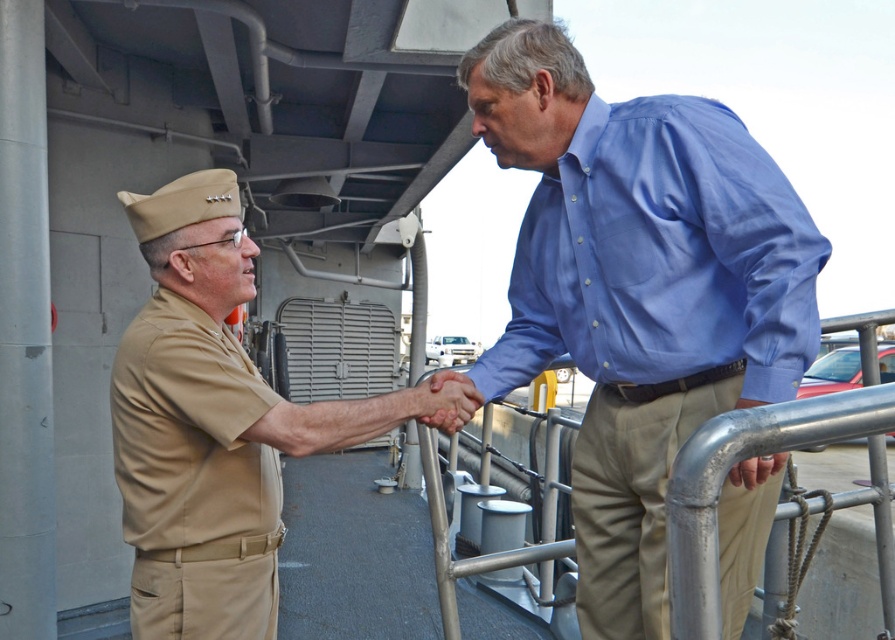
Measure the distance between point (x=274, y=636) and camera.

A distance of 2.18 meters exists between point (x=274, y=636) and camera.

Is khaki uniform at left below tan/khaki fabric uniform at left?

Actually, khaki uniform at left is above tan/khaki fabric uniform at left.

Which is behind, point (190, 621) or point (226, 502)?

Positioned behind is point (226, 502).

Where is `khaki uniform at left`? The height and width of the screenshot is (640, 895). khaki uniform at left is located at coordinates (215, 424).

Is blue button-up shirt at upper right closer to the viewer compared to tan/khaki fabric uniform at left?

That is True.

Who is lower down, blue button-up shirt at upper right or tan/khaki fabric uniform at left?

tan/khaki fabric uniform at left is below.

The image size is (895, 640). What do you see at coordinates (661, 257) in the screenshot? I see `blue button-up shirt at upper right` at bounding box center [661, 257].

Find the location of a particular element. The height and width of the screenshot is (640, 895). blue button-up shirt at upper right is located at coordinates (661, 257).

Which of these two, blue button-up shirt at upper right or khaki uniform at left, stands taller?

khaki uniform at left

Does point (575, 164) lie behind point (233, 227)?

No, (575, 164) is in front of (233, 227).

Between point (669, 109) and point (148, 531), which one is positioned behind?

Point (148, 531)

You are a GUI agent. You are given a task and a screenshot of the screen. Output one action in this format:
    pyautogui.click(x=<x>, y=<y>)
    Task: Click on the blue button-up shirt at upper right
    
    Given the screenshot: What is the action you would take?
    pyautogui.click(x=661, y=257)